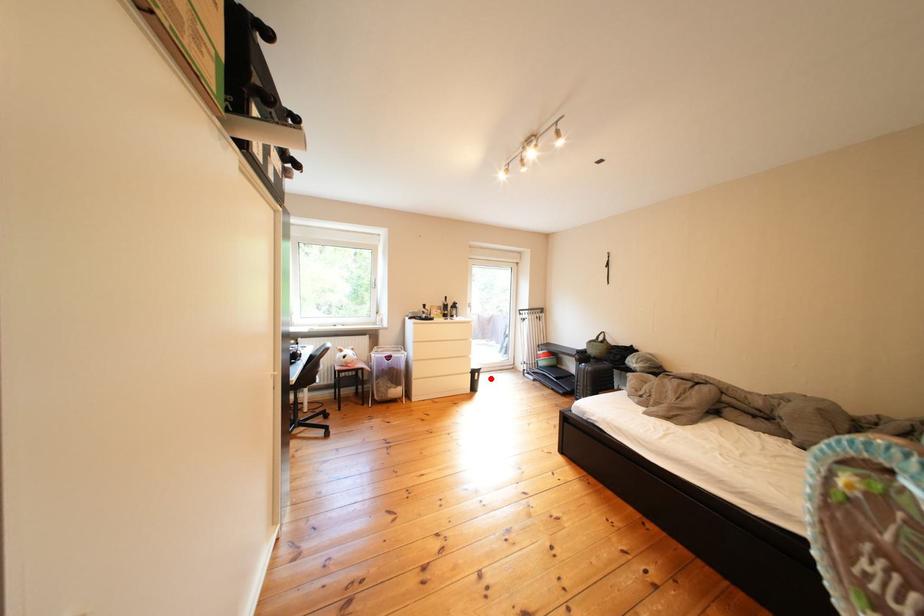
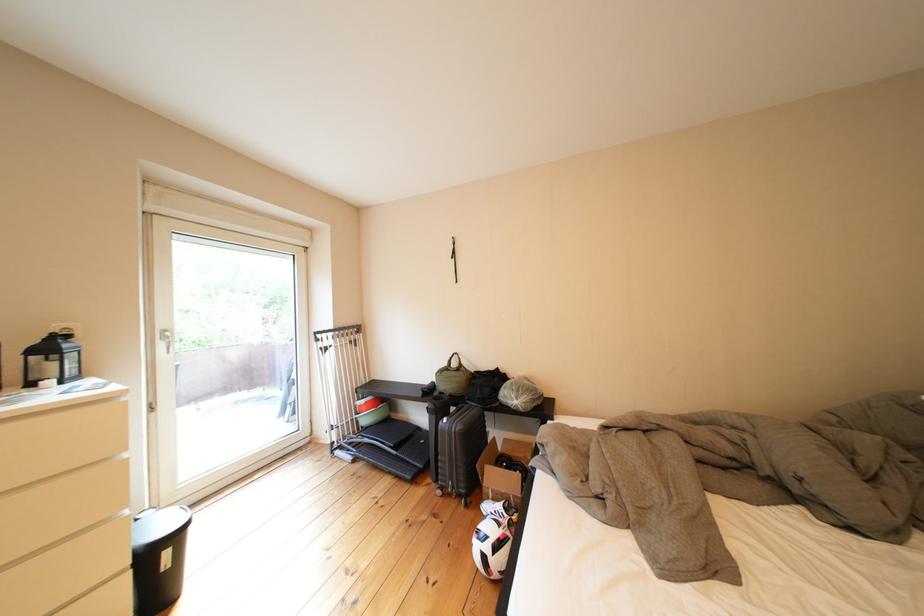
Question: I am providing you with two images of the same scene from different viewpoints. Given a red point in image1, look at the same physical point in image2. Is it:

Choices:
 (A) Closer to the viewpoint
 (B) Farther from the viewpoint

Answer: (A)